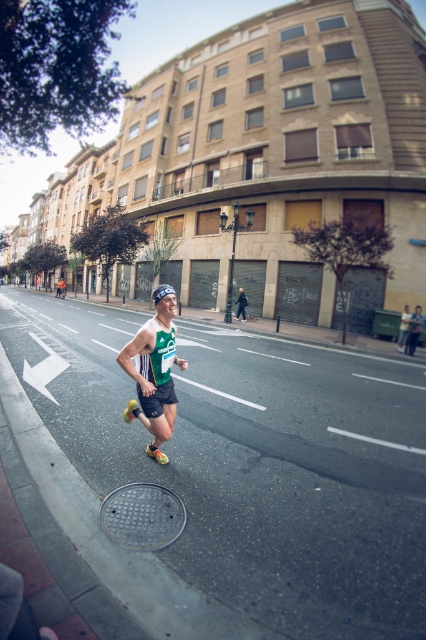
Question: Which point appears closest to the camera in this image?

Choices:
 (A) (158, 484)
 (B) (140, 369)

Answer: (A)

Question: Does green fabric runner at center appear over gray metallic manhole cover at lower center?

Choices:
 (A) no
 (B) yes

Answer: (B)

Question: Which object is farther from the camera taking this photo?

Choices:
 (A) gray metallic manhole cover at lower center
 (B) green fabric runner at center

Answer: (B)

Question: Can you confirm if green fabric runner at center is positioned to the right of gray metallic manhole cover at lower center?

Choices:
 (A) yes
 (B) no

Answer: (A)

Question: Observing the image, what is the correct spatial positioning of green fabric runner at center in reference to gray metallic manhole cover at lower center?

Choices:
 (A) above
 (B) below

Answer: (A)